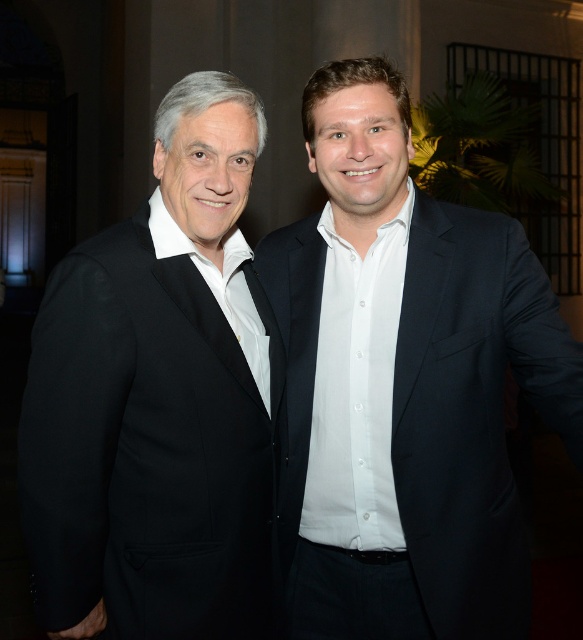
Question: Among these objects, which one is farthest from the camera?

Choices:
 (A) black matte suit at left
 (B) white smooth suit at center

Answer: (B)

Question: Is white smooth suit at center wider than black matte suit at left?

Choices:
 (A) yes
 (B) no

Answer: (A)

Question: Which object appears farthest from the camera in this image?

Choices:
 (A) white smooth suit at center
 (B) black matte suit at left

Answer: (A)

Question: Among these points, which one is farthest from the camera?

Choices:
 (A) (408, 108)
 (B) (113, 481)

Answer: (A)

Question: Does white smooth suit at center appear over black matte suit at left?

Choices:
 (A) no
 (B) yes

Answer: (B)

Question: Does white smooth suit at center have a lesser width compared to black matte suit at left?

Choices:
 (A) yes
 (B) no

Answer: (B)